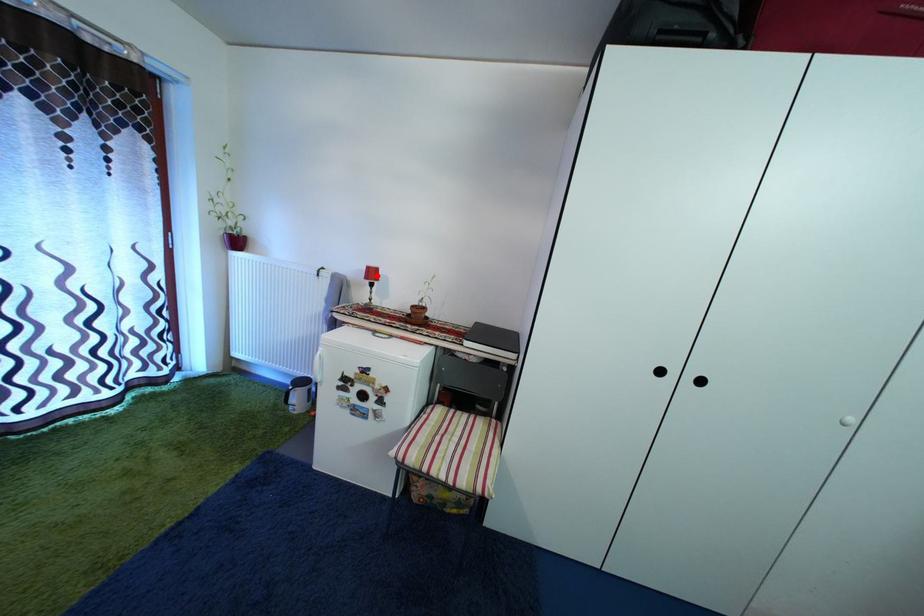
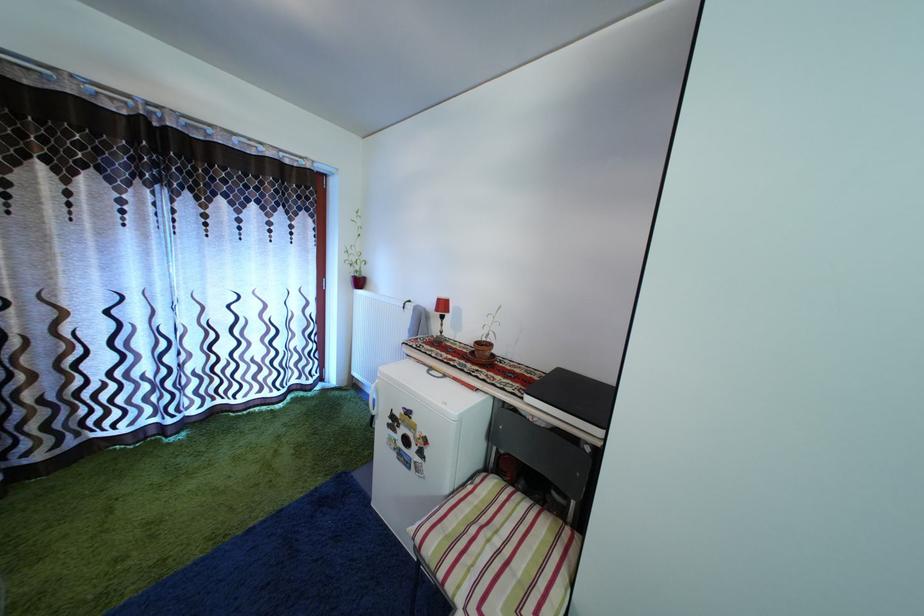
The point at the highlighted location is marked in the first image. Where is the corresponding point in the second image?

(446, 308)